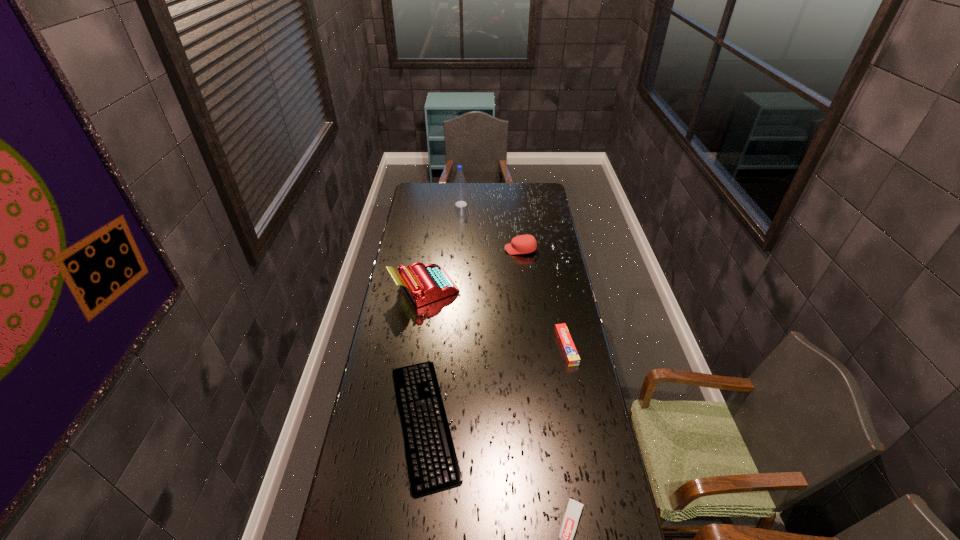
Identify the location of toothpaste that is positioned at the right edge. The image size is (960, 540). (570, 353).

At what (x,y) coordinates should I click in order to perform the action: click on vacant space at the left edge of the desktop. Please return your answer as a coordinate pair (x, y). The width and height of the screenshot is (960, 540). Looking at the image, I should click on (416, 361).

Locate an element on the screen. free space at the right edge of the desktop is located at coordinates (557, 304).

The height and width of the screenshot is (540, 960). What are the coordinates of `vacant point located between the shortest object and the third tallest object` in the screenshot? It's located at (472, 336).

Locate an element on the screen. The width and height of the screenshot is (960, 540). free spot between the typewriter and the tallest object is located at coordinates (443, 246).

Find the location of a particular element. This screenshot has width=960, height=540. free area in between the third tallest object and the farthest object is located at coordinates (491, 227).

What are the coordinates of `blank region between the farthest object and the fourth nearest object` in the screenshot? It's located at (443, 246).

I want to click on free space between the fourth shortest object and the fourth nearest object, so click(x=472, y=269).

The height and width of the screenshot is (540, 960). I want to click on free spot between the shortest object and the rightmost object, so click(x=495, y=384).

Find the location of a particular element. Image resolution: width=960 pixels, height=540 pixels. vacant point located between the shortest object and the cap is located at coordinates (472, 336).